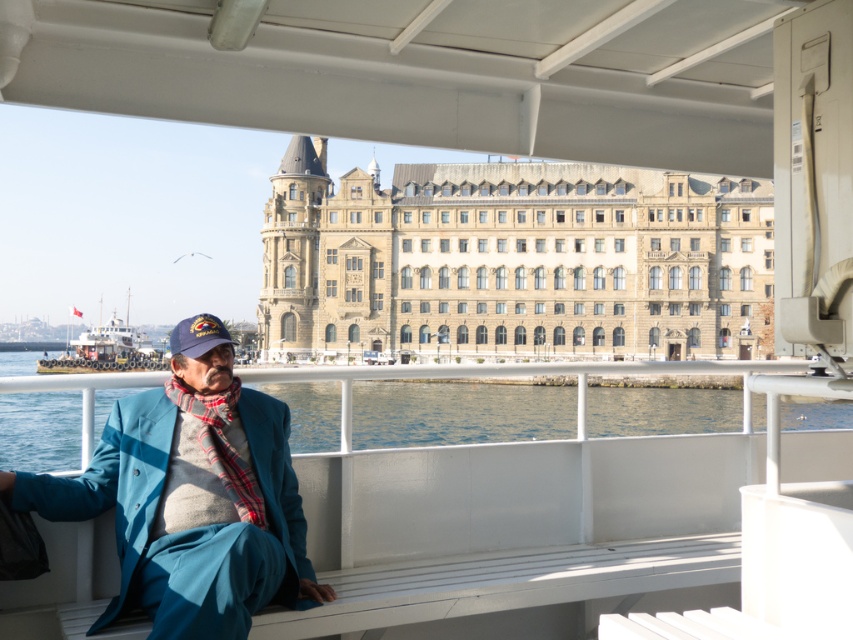
Question: Does teal woolen suit at left have a larger size compared to clear blue water at lower left?

Choices:
 (A) no
 (B) yes

Answer: (A)

Question: Does clear blue water at lower left come behind white plastic boat at lower left?

Choices:
 (A) no
 (B) yes

Answer: (A)

Question: Observing the image, what is the correct spatial positioning of teal woolen suit at left in reference to white plastic boat at lower left?

Choices:
 (A) right
 (B) left

Answer: (A)

Question: Among these objects, which one is farthest from the camera?

Choices:
 (A) white plastic boat at lower left
 (B) plaid wool scarf at center
 (C) teal woolen suit at left

Answer: (A)

Question: Which point is farther to the camera?

Choices:
 (A) (184, 500)
 (B) (264, 516)
 (C) (759, 410)
 (D) (97, 371)

Answer: (D)

Question: Among these points, which one is farthest from the camera?

Choices:
 (A) (38, 488)
 (B) (451, 406)
 (C) (236, 387)

Answer: (B)